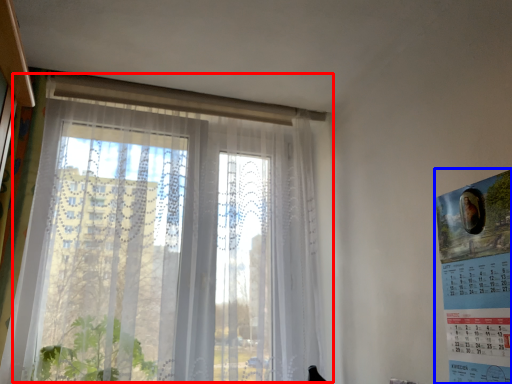
Question: Which object is closer to the camera taking this photo, window (highlighted by a red box) or poster page (highlighted by a blue box)?

Choices:
 (A) window
 (B) poster page

Answer: (B)